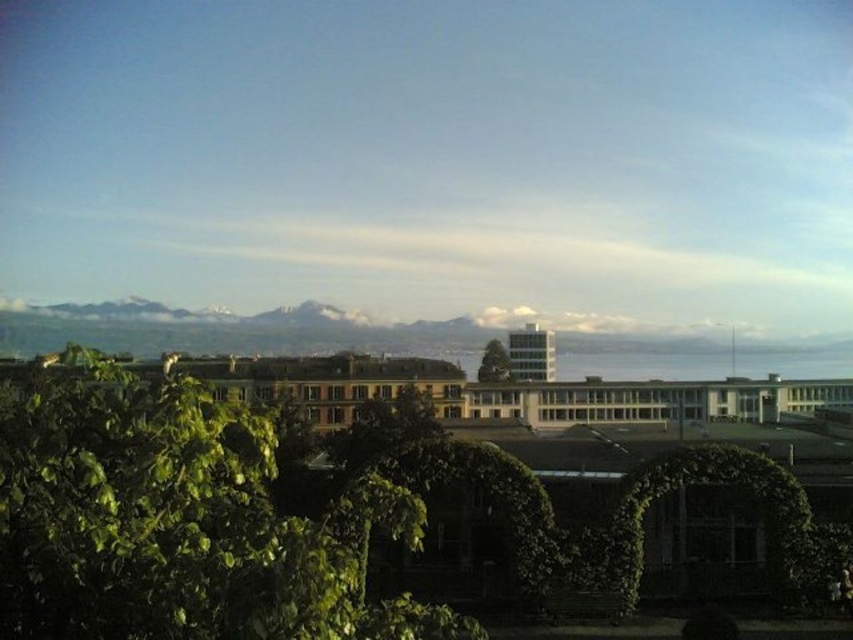
Question: Which object appears farthest from the camera in this image?

Choices:
 (A) green leafy tree at lower left
 (B) green leafy tree at center

Answer: (B)

Question: Can you confirm if green leafy tree at lower left is positioned below green leafy tree at center?

Choices:
 (A) no
 (B) yes

Answer: (A)

Question: Is green leafy tree at lower left thinner than green leafy tree at center?

Choices:
 (A) no
 (B) yes

Answer: (A)

Question: Which point is closer to the camera?

Choices:
 (A) green leafy tree at lower left
 (B) green leafy tree at center

Answer: (A)

Question: Is green leafy tree at lower left behind green leafy tree at center?

Choices:
 (A) yes
 (B) no

Answer: (B)